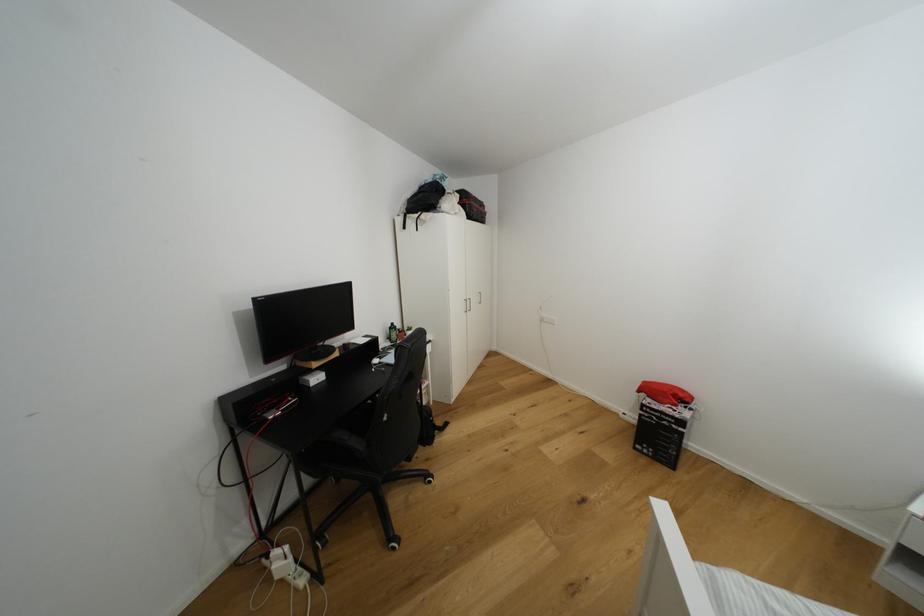
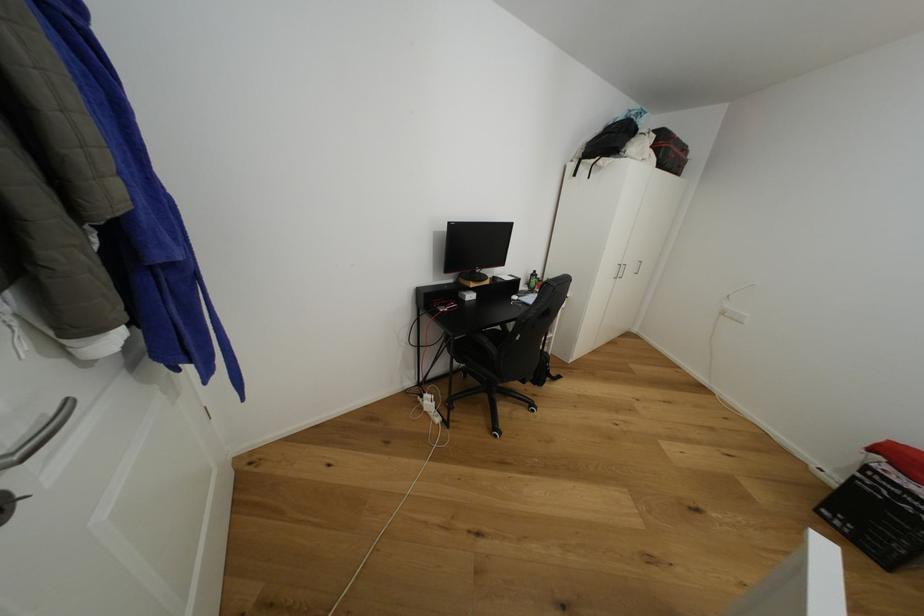
Question: The camera is either moving clockwise (left) or counter-clockwise (right) around the object. The first image is from the beginning of the video and the second image is from the end. Is the camera moving left or right when shooting the video?

Choices:
 (A) Left
 (B) Right

Answer: (B)